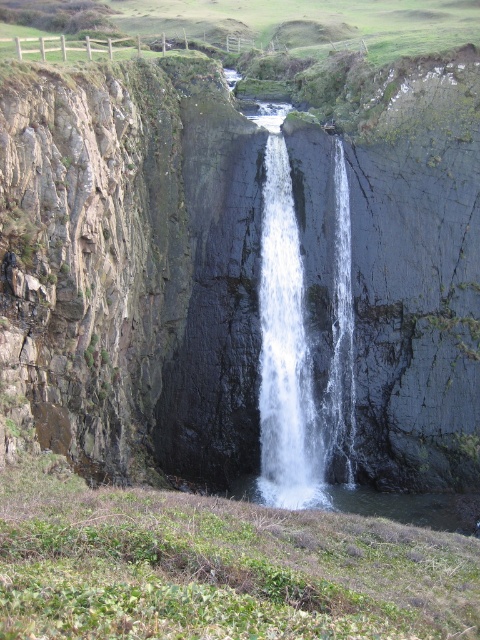
Who is positioned more to the right, dark gray rocky cliff at center or white frothy water at center?

Positioned to the right is white frothy water at center.

Is dark gray rocky cliff at center to the right of white frothy water at center from the viewer's perspective?

No, dark gray rocky cliff at center is not to the right of white frothy water at center.

Who is more distant from viewer, (48, 385) or (291, 353)?

The point (291, 353) is more distant.

The width and height of the screenshot is (480, 640). Find the location of `dark gray rocky cliff at center`. dark gray rocky cliff at center is located at coordinates (132, 268).